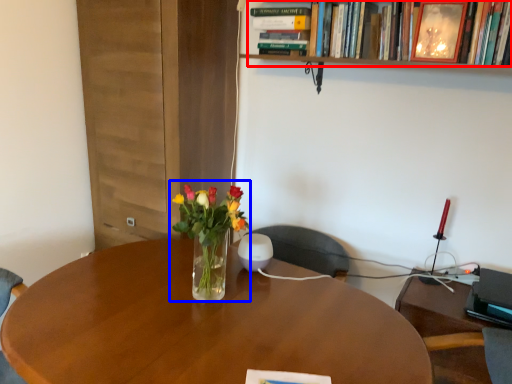
Question: Which object appears farthest to the camera in this image, book (highlighted by a red box) or floral arrangement (highlighted by a blue box)?

Choices:
 (A) book
 (B) floral arrangement

Answer: (A)